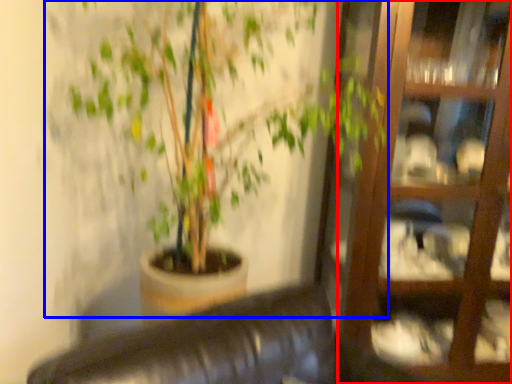
Question: Which object appears farthest to the camera in this image, glass door (highlighted by a red box) or houseplant (highlighted by a blue box)?

Choices:
 (A) glass door
 (B) houseplant

Answer: (A)